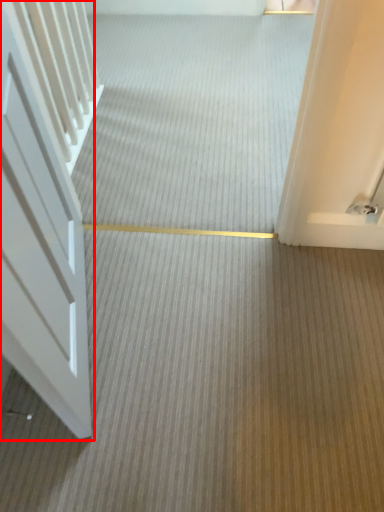
Question: In this image, where is door (annotated by the red box) located relative to plain?

Choices:
 (A) left
 (B) right

Answer: (A)